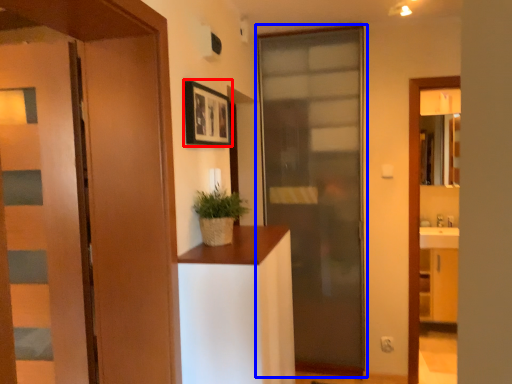
Question: Which point is further to the camera, picture frame (highlighted by a red box) or door (highlighted by a blue box)?

Choices:
 (A) picture frame
 (B) door

Answer: (B)